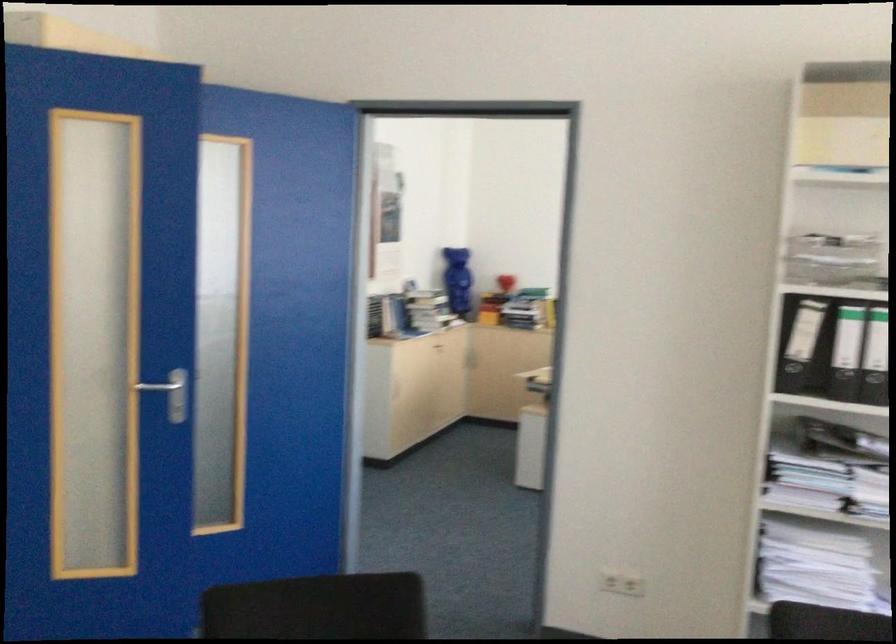
Where would you push the metal door handle? Please return your answer as a coordinate pair (x, y).

(176, 398)